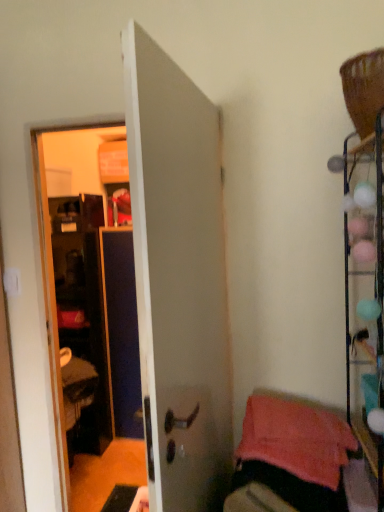
Question: From the image's perspective, is metallic wire rack at right under white matte door at center?

Choices:
 (A) no
 (B) yes

Answer: (A)

Question: Is the surface of metallic wire rack at right in direct contact with white matte door at center?

Choices:
 (A) yes
 (B) no

Answer: (B)

Question: Is metallic wire rack at right outside white matte door at center?

Choices:
 (A) yes
 (B) no

Answer: (A)

Question: From a real-world perspective, is metallic wire rack at right physically below white matte door at center?

Choices:
 (A) yes
 (B) no

Answer: (B)

Question: Is metallic wire rack at right oriented towards white matte door at center?

Choices:
 (A) yes
 (B) no

Answer: (A)

Question: From a real-world perspective, is white matte door at center positioned above or below metallic wire rack at right?

Choices:
 (A) above
 (B) below

Answer: (B)

Question: From their relative heights in the image, would you say white matte door at center is taller or shorter than metallic wire rack at right?

Choices:
 (A) tall
 (B) short

Answer: (A)

Question: In terms of width, does white matte door at center look wider or thinner when compared to metallic wire rack at right?

Choices:
 (A) wide
 (B) thin

Answer: (B)

Question: Would you say white matte door at center is to the left or to the right of metallic wire rack at right in the picture?

Choices:
 (A) right
 (B) left

Answer: (B)

Question: In terms of size, does pink soft towel at lower right appear bigger or smaller than white matte door at center?

Choices:
 (A) small
 (B) big

Answer: (A)

Question: Is pink soft towel at lower right taller or shorter than white matte door at center?

Choices:
 (A) short
 (B) tall

Answer: (A)

Question: From a real-world perspective, is pink soft towel at lower right physically located above or below white matte door at center?

Choices:
 (A) above
 (B) below

Answer: (B)

Question: From the image's perspective, is pink soft towel at lower right positioned above or below white matte door at center?

Choices:
 (A) below
 (B) above

Answer: (A)

Question: From a real-world perspective, is pink soft towel at lower right positioned above or below metallic wire rack at right?

Choices:
 (A) above
 (B) below

Answer: (B)

Question: Is pink soft towel at lower right wider or thinner than metallic wire rack at right?

Choices:
 (A) wide
 (B) thin

Answer: (A)